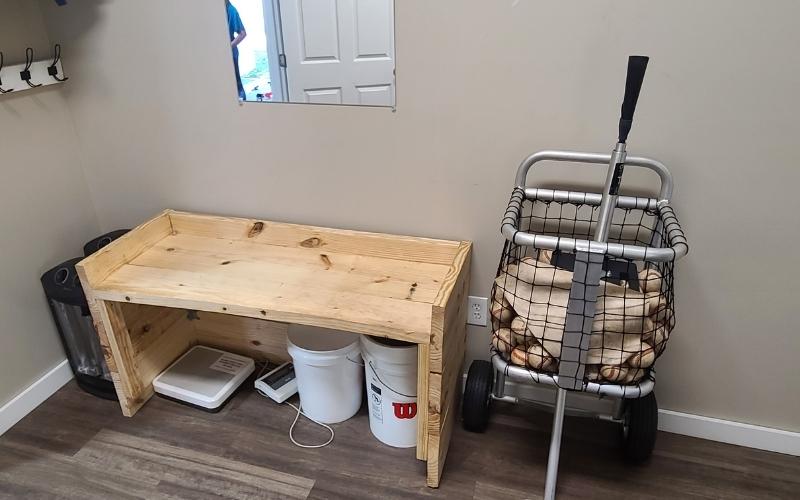
This screenshot has height=500, width=800. I want to click on basket, so (x=574, y=338).